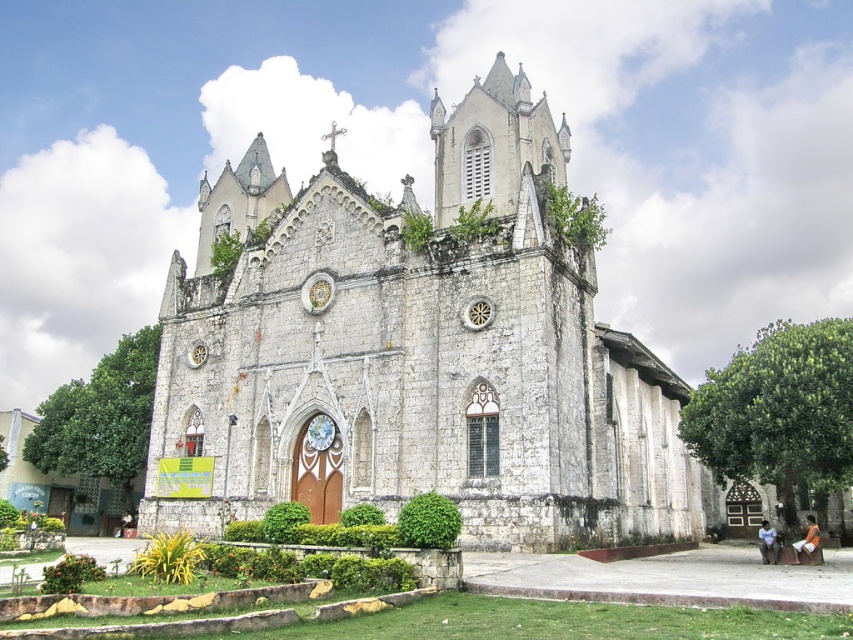
Question: Considering the real-world distances, which object is farthest from the white stone chapel at center?

Choices:
 (A) orange cotton shorts at lower right
 (B) blue denim shirt at lower right

Answer: (A)

Question: Does white stone chapel at center have a greater width compared to blue denim shirt at lower right?

Choices:
 (A) yes
 (B) no

Answer: (A)

Question: Considering the real-world distances, which object is farthest from the orange cotton shorts at lower right?

Choices:
 (A) blue denim shirt at lower right
 (B) white stone chapel at center

Answer: (B)

Question: Is white stone chapel at center above blue denim shirt at lower right?

Choices:
 (A) no
 (B) yes

Answer: (B)

Question: In this image, where is white stone chapel at center located relative to orange cotton shorts at lower right?

Choices:
 (A) above
 (B) below

Answer: (A)

Question: Which of the following is the farthest from the observer?

Choices:
 (A) (815, 532)
 (B) (241, 432)
 (C) (772, 552)

Answer: (B)